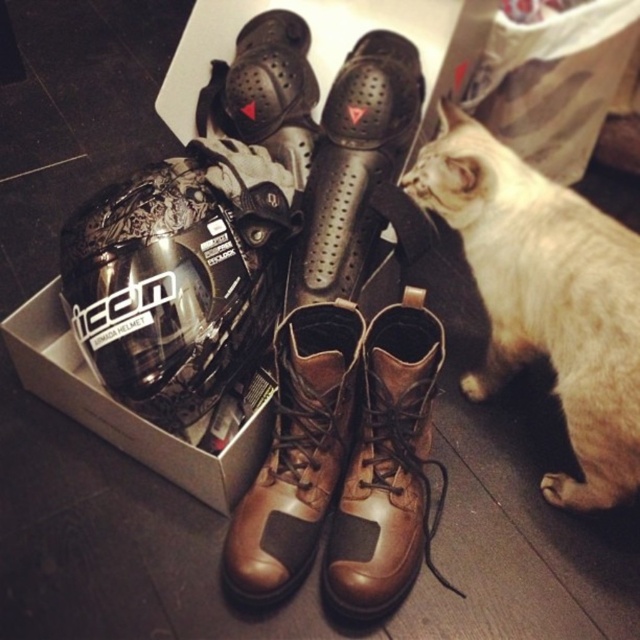
You are a photographer setting up a shot of the motorcycle gear. You want to ensure the white fur cat at lower right doesn not appear in the background. How far back should you stand to keep it out of the frame?

To keep the white fur cat at lower right out of the frame, you should stand at least 3.44 feet away from it.

You are standing in front of the motorcycle gear arrangement. If you want to place a new item at point 0.7, 0.6, which is closer to the brown leather boot at center or the edge of the image?

The brown leather boot at center is located at point (388,467). The distance from this point to the desired point (384,448) is sqrt??

You are organizing a photo shoot and need to position the white fur cat at lower right and the brown leather boot at center in the frame. Which object is wider?

Answer: The white fur cat at lower right is wider than the brown leather boot at center.